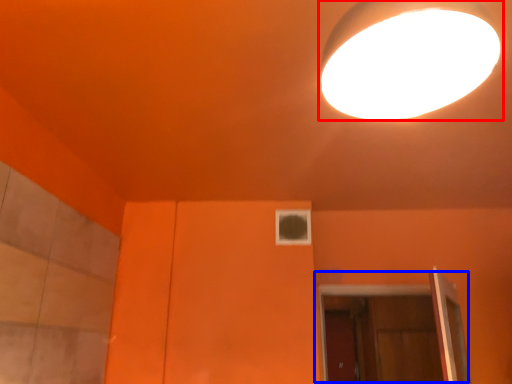
Question: Which object appears farthest to the camera in this image, lamp (highlighted by a red box) or door (highlighted by a blue box)?

Choices:
 (A) lamp
 (B) door

Answer: (B)